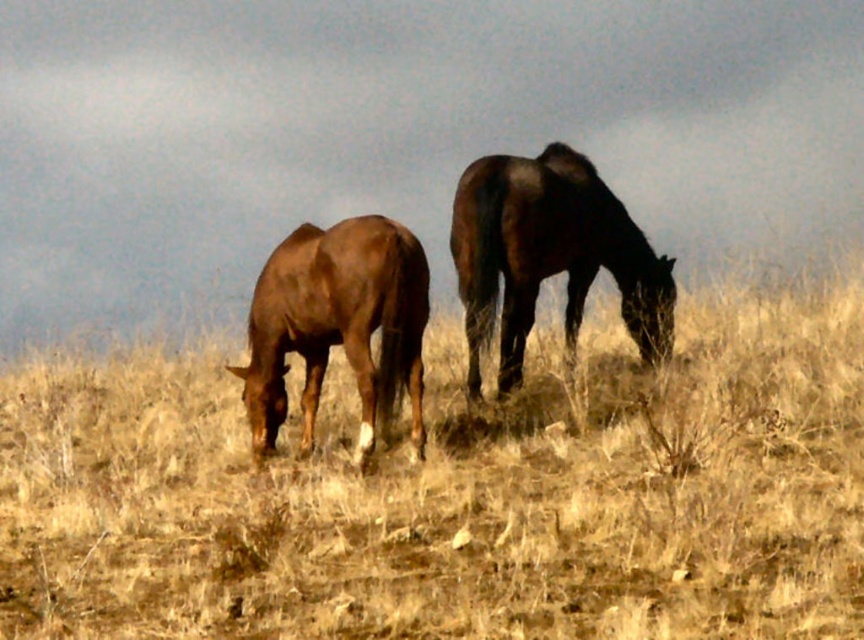
Based on the photo, you are a farmer who needs to check the distance between the brown grassy at center and the brown glossy horse at left. According to the image, how far apart are they?

The brown grassy at center is 11.50 feet from the brown glossy horse at left.

You are a farmer checking the field. You notice the brown grassy at center and the shiny dark brown horse at center. Which one has a shorter height?

The brown grassy at center is shorter than the shiny dark brown horse at center.

You are a photographer aiming to capture the shiny dark brown horse at center while ensuring the brown grassy at center is visible in the background. Based on their positions, can you confirm if the horse is standing above the grassy area?

The brown grassy at center is below the shiny dark brown horse at center, so yes, the horse is positioned above the grassy area, making it possible to have the grass visible in the background.